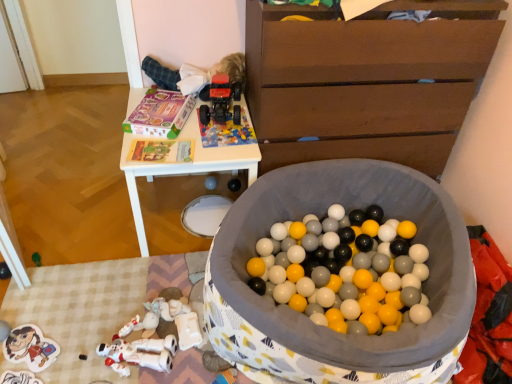
Where is `free space in front of rubberized red toy truck at upper center, which is the 4th toy from left to right`? The width and height of the screenshot is (512, 384). free space in front of rubberized red toy truck at upper center, which is the 4th toy from left to right is located at coordinates (218, 138).